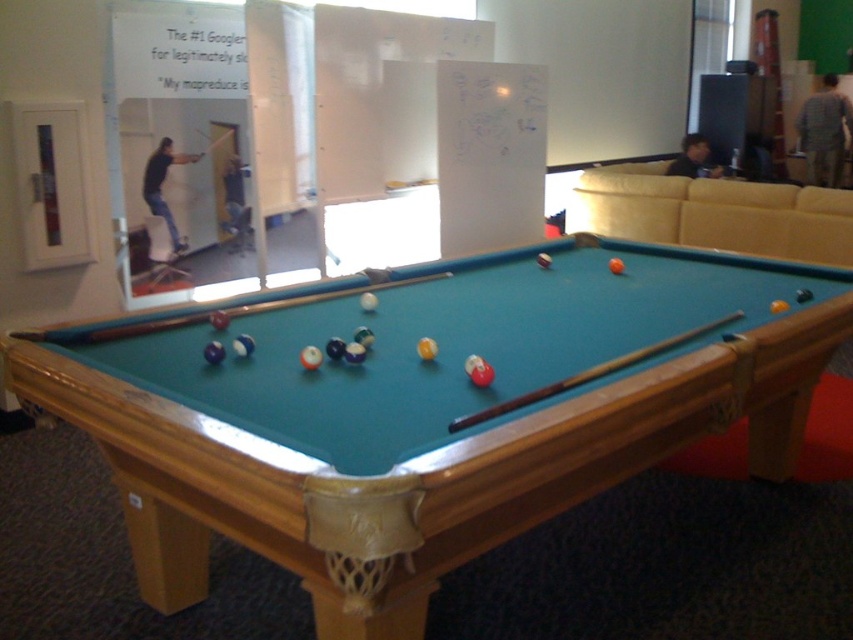
Question: Is matte black shirt at upper left bigger than smooth skin face at upper right?

Choices:
 (A) yes
 (B) no

Answer: (B)

Question: Among these points, which one is nearest to the camera?

Choices:
 (A) (477, 413)
 (B) (804, 144)
 (C) (679, 164)
 (D) (242, 317)

Answer: (A)

Question: Is wooden smooth cue at center positioned behind gray plaid shirt at upper right?

Choices:
 (A) yes
 (B) no

Answer: (B)

Question: Is wooden cue at center above smooth skin face at upper right?

Choices:
 (A) yes
 (B) no

Answer: (B)

Question: Which point is closer to the camera?

Choices:
 (A) gray plaid shirt at upper right
 (B) wooden cue at center

Answer: (B)

Question: Among these objects, which one is farthest from the camera?

Choices:
 (A) gray plaid shirt at upper right
 (B) smooth skin face at upper right
 (C) teal felt pool table at center
 (D) matte black shirt at upper left

Answer: (A)